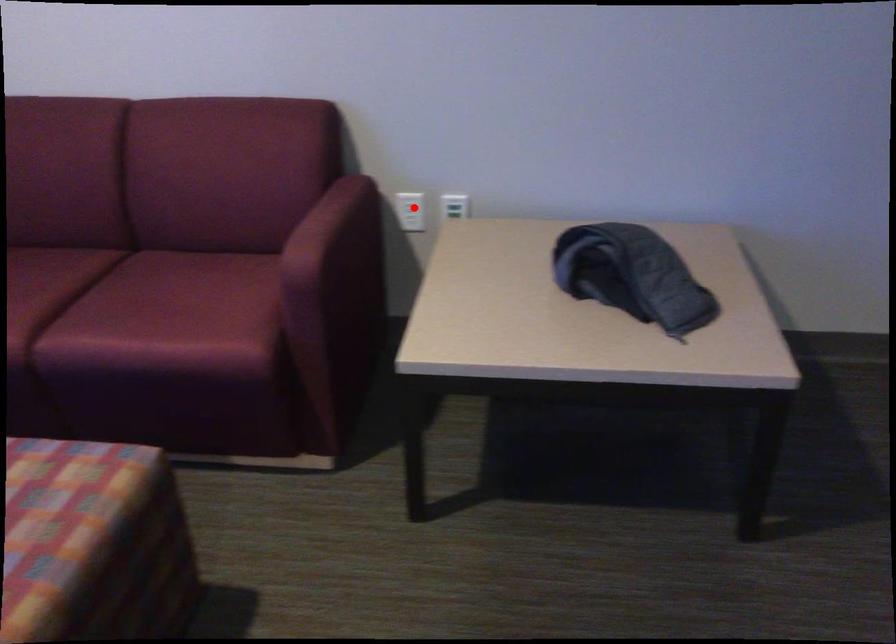
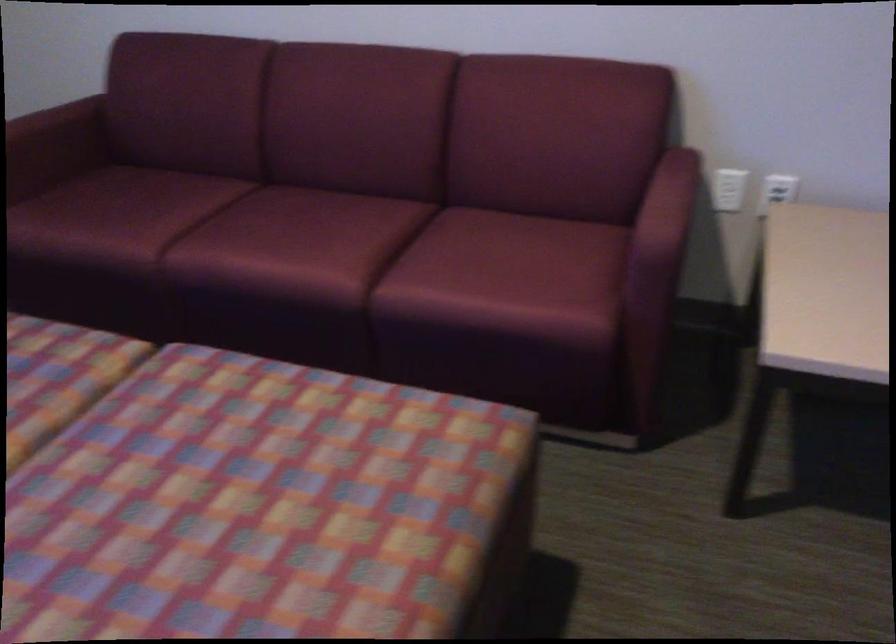
Locate, in the second image, the point that corresponds to the highlighted location in the first image.

(728, 189)